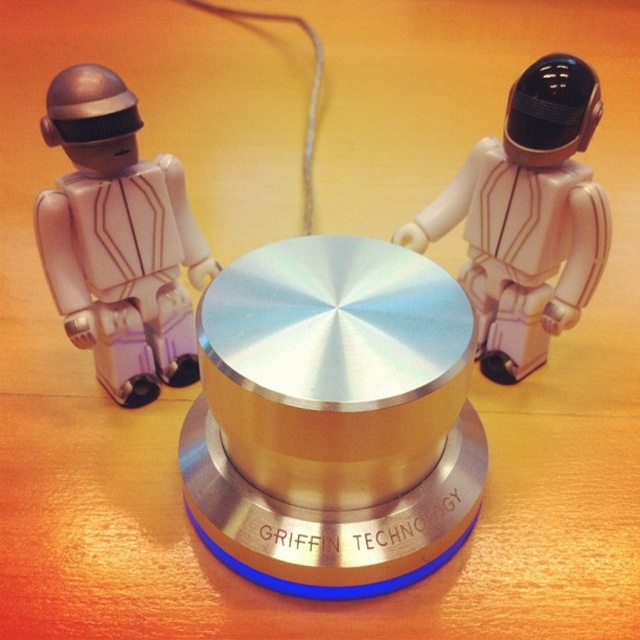
Which of these two, satin silver knob at center or white plastic astronaut at center, stands taller?

Standing taller between the two is satin silver knob at center.

Between point (252, 500) and point (589, 227), which one is positioned in front?

Point (252, 500) is more forward.

Locate an element on the screen. The height and width of the screenshot is (640, 640). satin silver knob at center is located at coordinates coord(333,417).

You are a GUI agent. You are given a task and a screenshot of the screen. Output one action in this format:
    pyautogui.click(x=<x>, y=<y>)
    Task: Click on the satin silver knob at center
    The width and height of the screenshot is (640, 640).
    Given the screenshot: What is the action you would take?
    pyautogui.click(x=333, y=417)

Is satin silver knob at center positioned before matte white robot at left?

Yes, it is.

Can you confirm if satin silver knob at center is wider than matte white robot at left?

Correct, the width of satin silver knob at center exceeds that of matte white robot at left.

Which is in front, point (394, 493) or point (195, 353)?

Point (394, 493)

Where is `satin silver knob at center`? This screenshot has height=640, width=640. satin silver knob at center is located at coordinates (333, 417).

Can you confirm if matte white robot at left is positioned below white plastic astronaut at center?

Incorrect, matte white robot at left is not positioned below white plastic astronaut at center.

Is matte white robot at left further to the viewer compared to white plastic astronaut at center?

Yes, matte white robot at left is behind white plastic astronaut at center.

Between point (180, 352) and point (529, 256), which one is positioned in front?

Point (529, 256) is in front.

Locate an element on the screen. This screenshot has height=640, width=640. matte white robot at left is located at coordinates (118, 240).